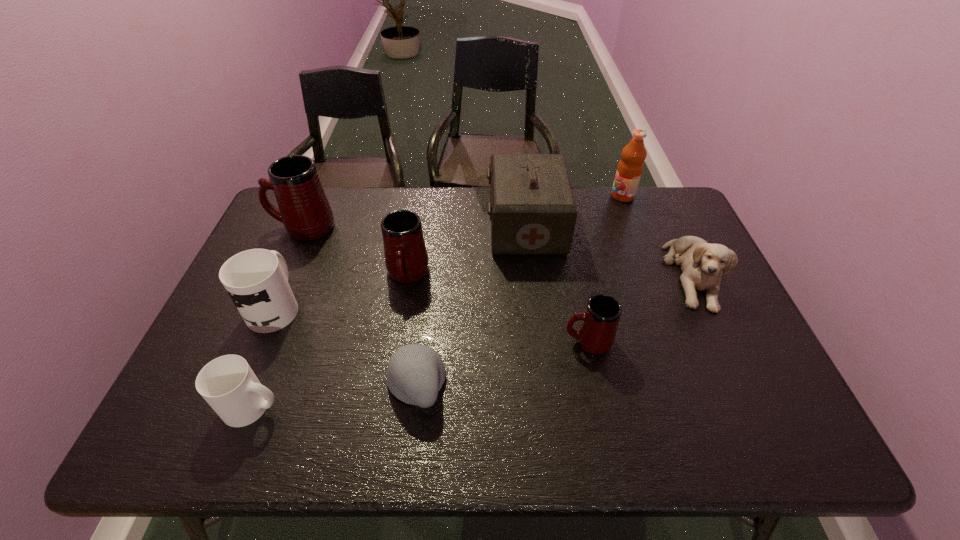
This screenshot has width=960, height=540. Find the location of `the second object from right to left`. the second object from right to left is located at coordinates (630, 167).

The height and width of the screenshot is (540, 960). Find the location of `the farthest mug`. the farthest mug is located at coordinates (304, 209).

Where is `the biggest red mug`? The image size is (960, 540). the biggest red mug is located at coordinates (304, 209).

What are the coordinates of `red first-aid kit` in the screenshot? It's located at (532, 209).

What are the coordinates of `the second red mug from right to left` in the screenshot? It's located at (406, 259).

Where is `the second biggest red mug`? the second biggest red mug is located at coordinates (406, 259).

Where is `the farther white mug`? The height and width of the screenshot is (540, 960). the farther white mug is located at coordinates (256, 280).

Locate an element on the screen. the rightmost object is located at coordinates (702, 263).

What are the coordinates of `puppy` in the screenshot? It's located at (702, 263).

Find the location of a particular element. the smallest red mug is located at coordinates (596, 333).